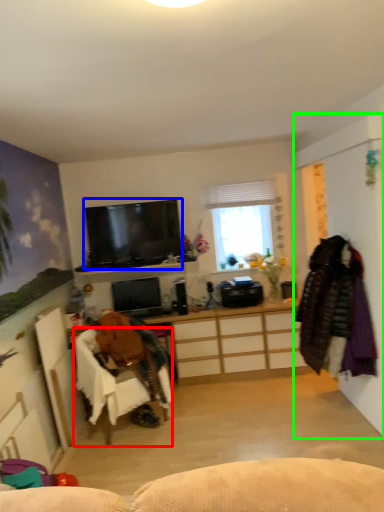
Question: Which is farther away from chair (highlighted by a red box)? television (highlighted by a blue box) or side (highlighted by a green box)?

Choices:
 (A) television
 (B) side

Answer: (B)